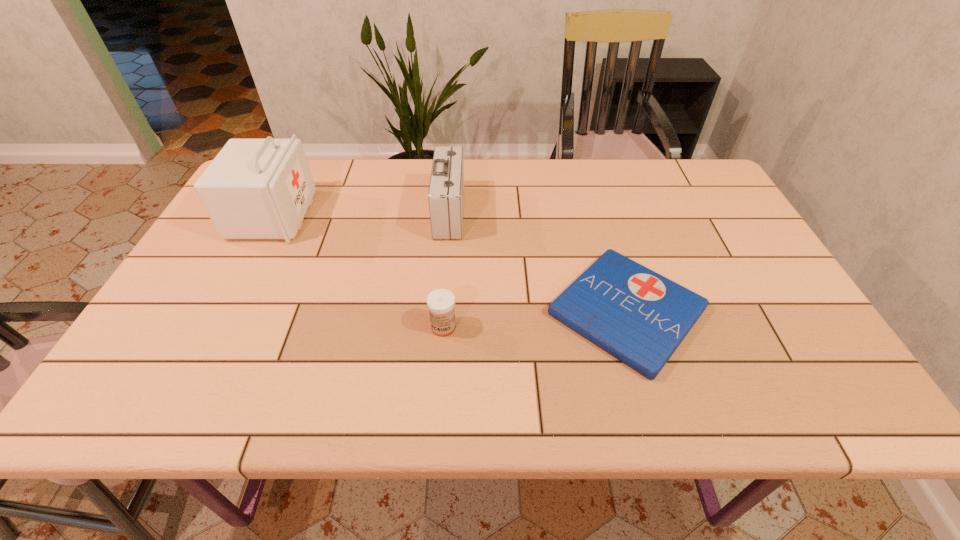
Image resolution: width=960 pixels, height=540 pixels. I want to click on vacant space located 0.270m on the back of the shortest first-aid kit, so click(x=592, y=195).

Where is `object situated at the near edge`? The height and width of the screenshot is (540, 960). object situated at the near edge is located at coordinates (638, 316).

This screenshot has height=540, width=960. Find the location of `object situated at the left edge`. object situated at the left edge is located at coordinates point(255,188).

Identify the location of object located at the far left corner. This screenshot has height=540, width=960. (255, 188).

Image resolution: width=960 pixels, height=540 pixels. I want to click on free spot at the far edge of the desktop, so click(x=535, y=167).

The image size is (960, 540). I want to click on free region at the near edge of the desktop, so pos(541,394).

This screenshot has height=540, width=960. I want to click on vacant region at the left edge of the desktop, so click(x=233, y=271).

Where is `vacant space at the right edge of the desktop`? vacant space at the right edge of the desktop is located at coordinates (804, 350).

You are a GUI agent. You are given a task and a screenshot of the screen. Output one action in this format:
    pyautogui.click(x=<x>, y=<y>)
    Task: Click on the vacant position at the near right corner of the desktop
    
    Given the screenshot: What is the action you would take?
    pyautogui.click(x=795, y=410)

Where is `vacant region between the tallest object and the third tallest object`? This screenshot has height=540, width=960. vacant region between the tallest object and the third tallest object is located at coordinates (358, 272).